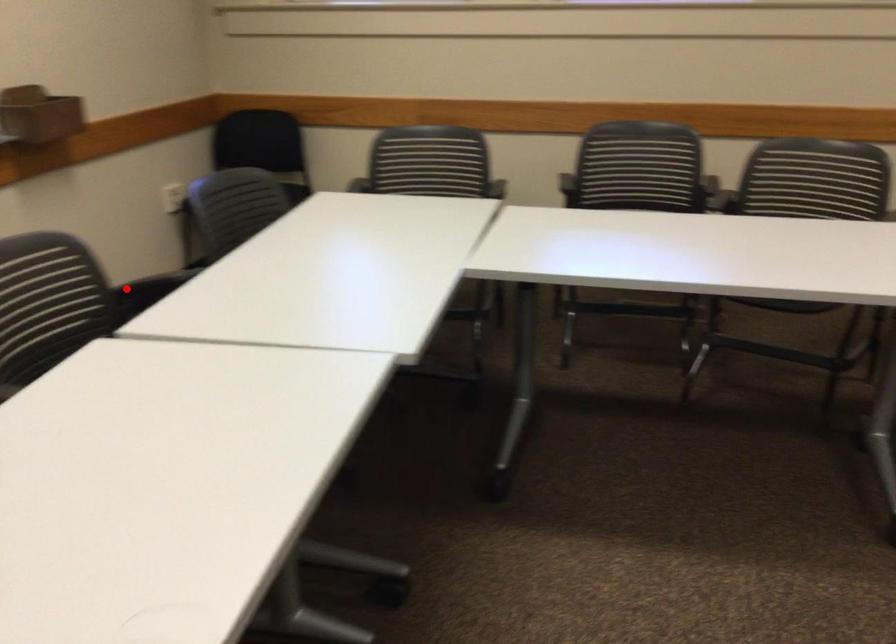
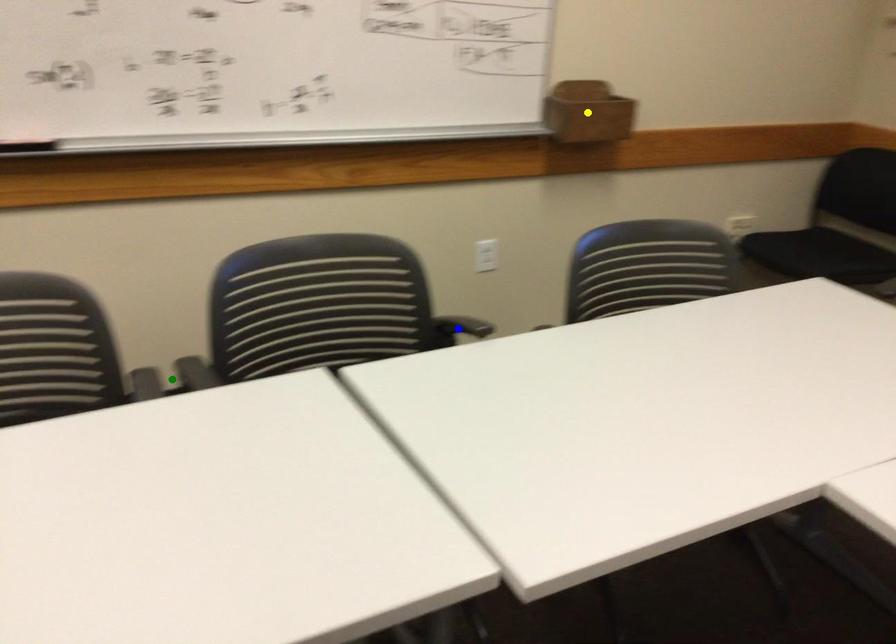
Question: I am providing you with two images of the same scene from different viewpoints. A red point is marked on the first image. You are given multiple points on the second image. Which point in image 2 is actually the same real-world point as the red point in image 1?

Choices:
 (A) blue point
 (B) yellow point
 (C) green point

Answer: (A)